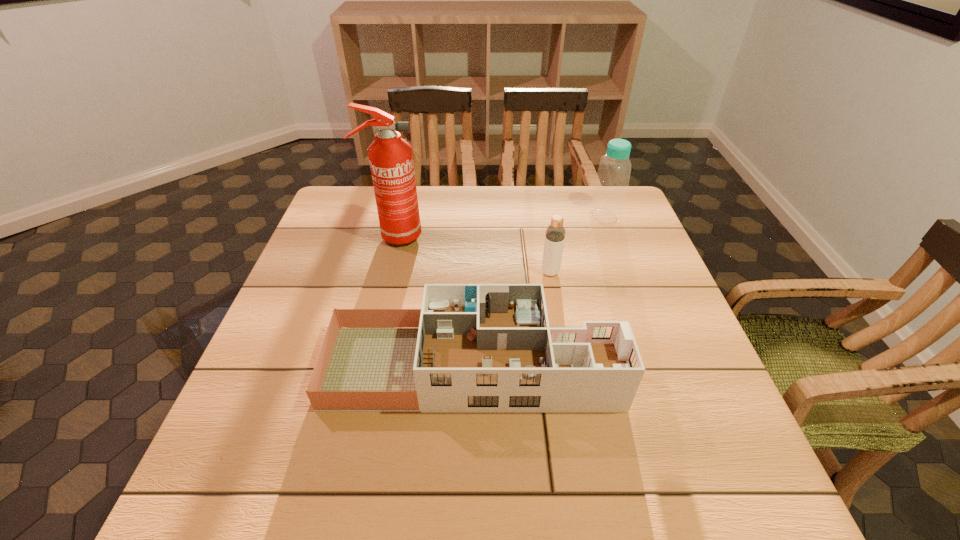
At what (x,y) coordinates should I click in order to perform the action: click on vacant space that satisfies the following two spatial constraints: 1. at the nozzle of the tallest object; 2. on the left side of the second shortest object. Please return your answer as a coordinate pair (x, y). This screenshot has height=540, width=960. Looking at the image, I should click on (385, 272).

Where is `free location that satisfies the following two spatial constraints: 1. on the back side of the shorter bottle; 2. at the nozzle of the tallest object`? free location that satisfies the following two spatial constraints: 1. on the back side of the shorter bottle; 2. at the nozzle of the tallest object is located at coordinates (544, 236).